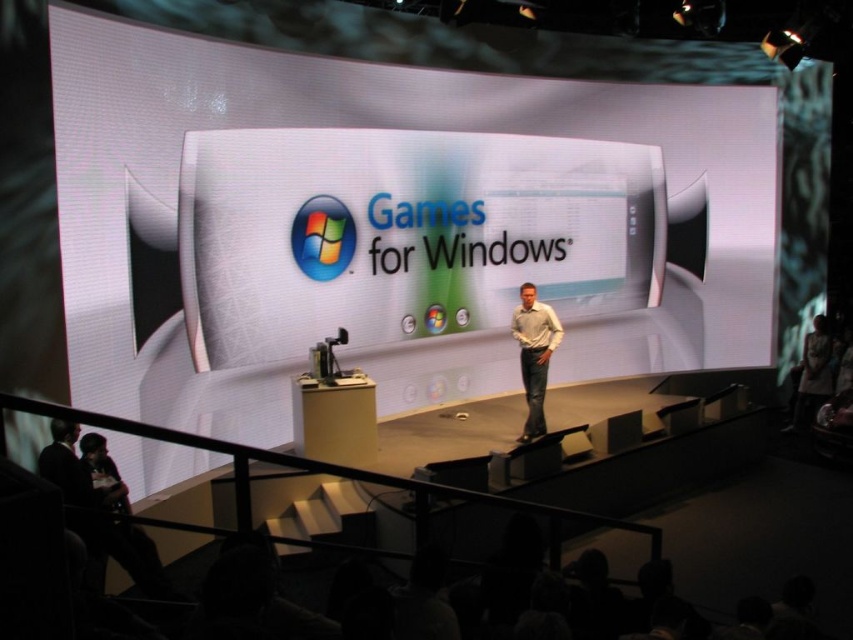
You are a stagehand setting up a new light at point A which is at coordinate point (242, 211) and need to ensure it doesn t block the view of the screen located at coordinate point (825, 397). Will the light at point A block the view of the screen at point B?

Point (242, 211) is in front of point (825, 397), so the light at point A will block the view of the screen at point B.

You are organizing a small presentation in a room with limited space. You need to place the white glossy projection screen at center and the light brown leather jacket at right. Given their sizes, which object should you prioritize placing first to ensure they fit properly?

The white glossy projection screen at center is larger than the light brown leather jacket at right, so you should prioritize placing the white glossy projection screen at center first to ensure there is enough space for it.